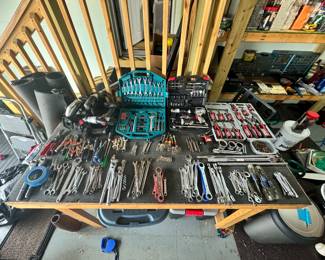
Where is `tile floor`? The image size is (325, 260). tile floor is located at coordinates (168, 243).